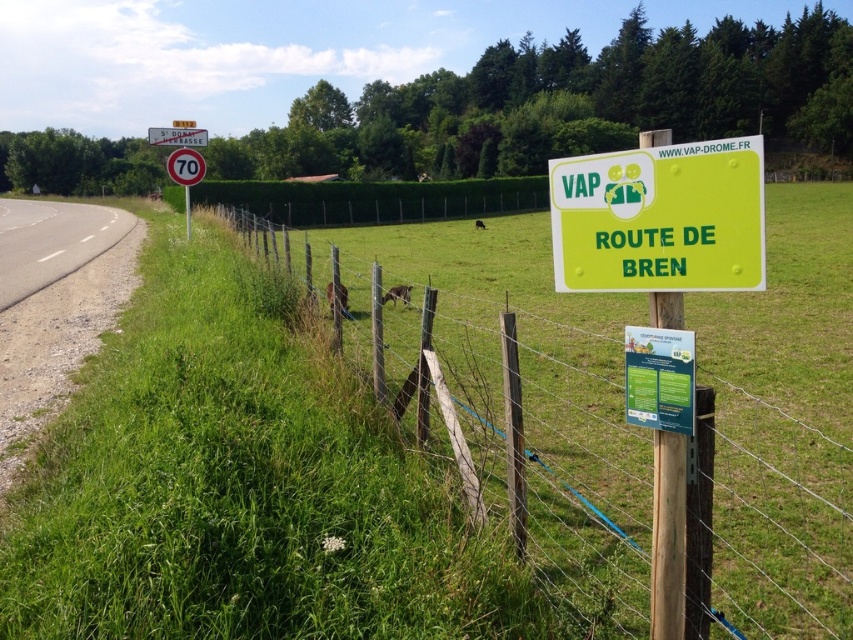
Can you confirm if wooden post at center is thinner than green plastic sign at center-right?

Incorrect, wooden post at center's width is not less than green plastic sign at center-right's.

Is wooden post at center positioned before green plastic sign at center-right?

No, wooden post at center is further to the viewer.

This screenshot has height=640, width=853. What do you see at coordinates (767, 522) in the screenshot?
I see `wooden post at center` at bounding box center [767, 522].

Where is `wooden post at center`? wooden post at center is located at coordinates (767, 522).

Which is more to the right, wooden post at center or metallic red sign at upper center?

wooden post at center

Which is above, wooden post at center or metallic red sign at upper center?

Positioned higher is metallic red sign at upper center.

Which is in front, point (636, 483) or point (195, 144)?

Positioned in front is point (636, 483).

Where is `wooden post at center`? wooden post at center is located at coordinates (767, 522).

Based on the photo, which is more to the left, green plastic sign at center-right or metallic red sign at upper center?

metallic red sign at upper center

Is green plastic sign at center-right positioned before metallic red sign at upper center?

Yes, green plastic sign at center-right is closer to the viewer.

Between point (717, 288) and point (196, 128), which one is positioned in front?

Point (717, 288) is more forward.

Find the location of a particular element. This screenshot has width=853, height=640. green plastic sign at center-right is located at coordinates (660, 218).